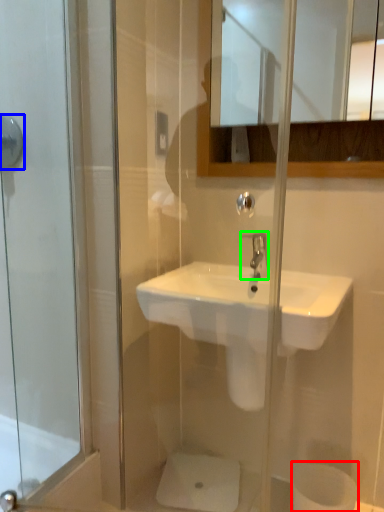
Question: Considering the real-world distances, which object is farthest from toilet paper (highlighted by a red box)? shower (highlighted by a blue box) or tap (highlighted by a green box)?

Choices:
 (A) shower
 (B) tap

Answer: (A)